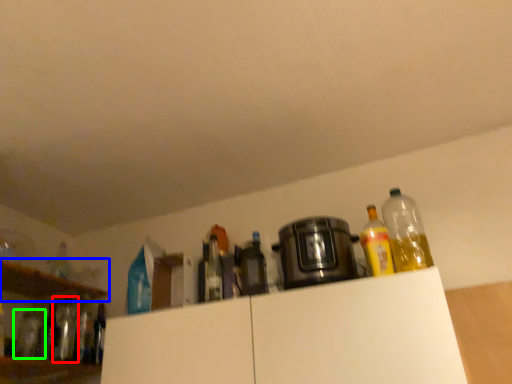
Question: Considering the real-world distances, which object is closest to bottle (highlighted by a red box)? shelf (highlighted by a blue box) or bottle (highlighted by a green box).

Choices:
 (A) shelf
 (B) bottle

Answer: (B)